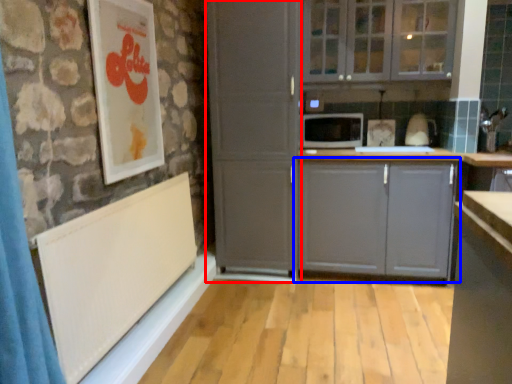
Question: Which point is closer to the camera, screen door (highlighted by a red box) or cabinetry (highlighted by a blue box)?

Choices:
 (A) screen door
 (B) cabinetry

Answer: (A)